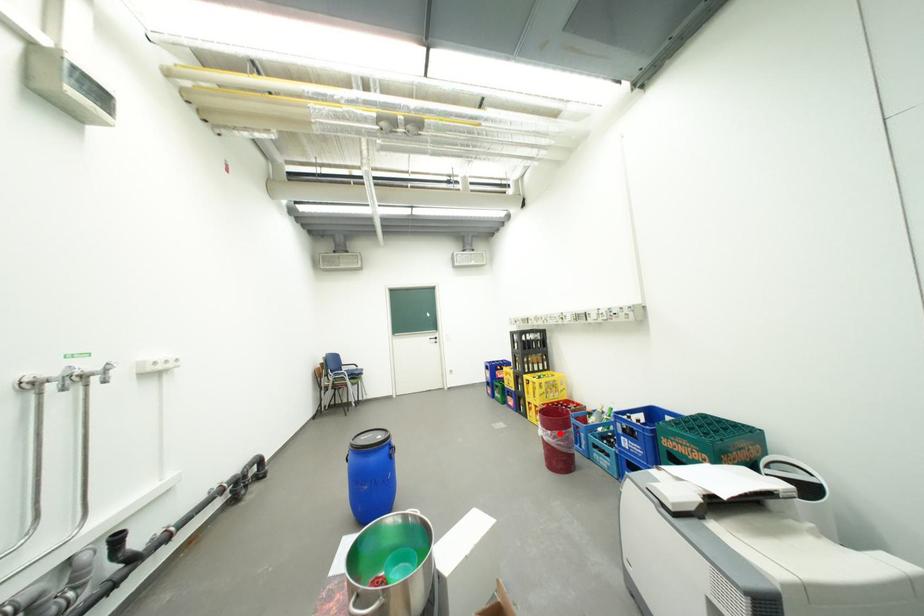
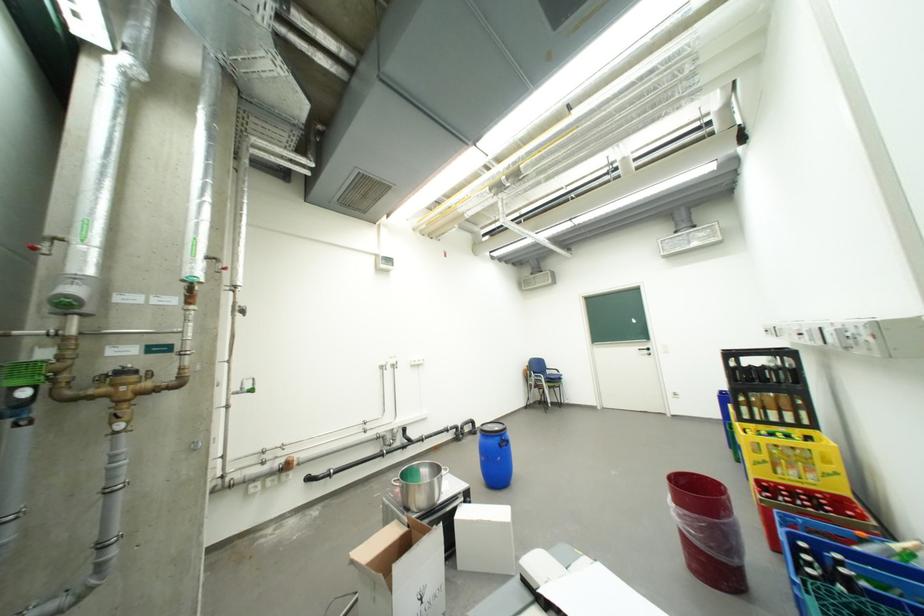
Question: I am providing you with two images of the same scene from different viewpoints. A red point is marked on the first image. At the location where the point appears in image 1, is it still visible in image 2?

Choices:
 (A) Yes
 (B) No

Answer: (A)